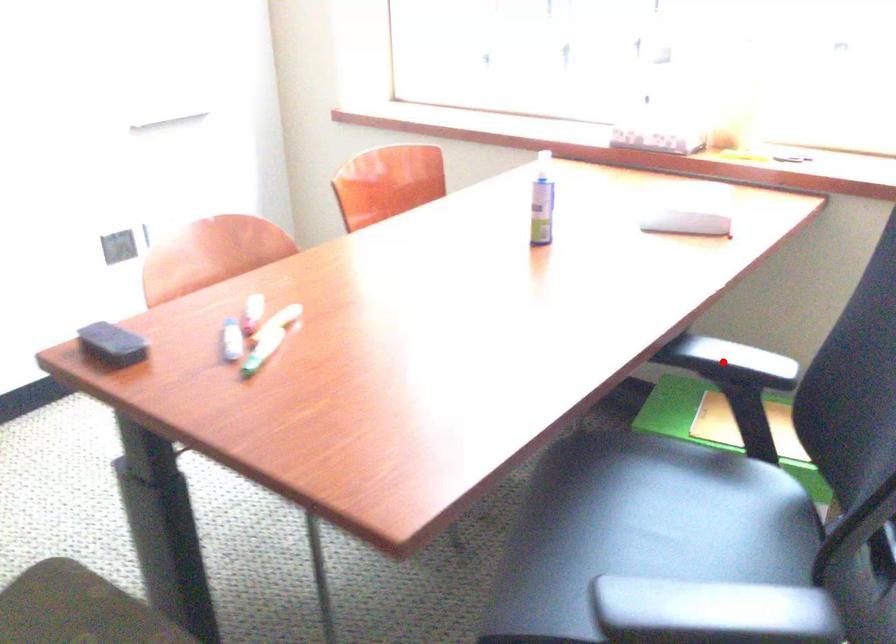
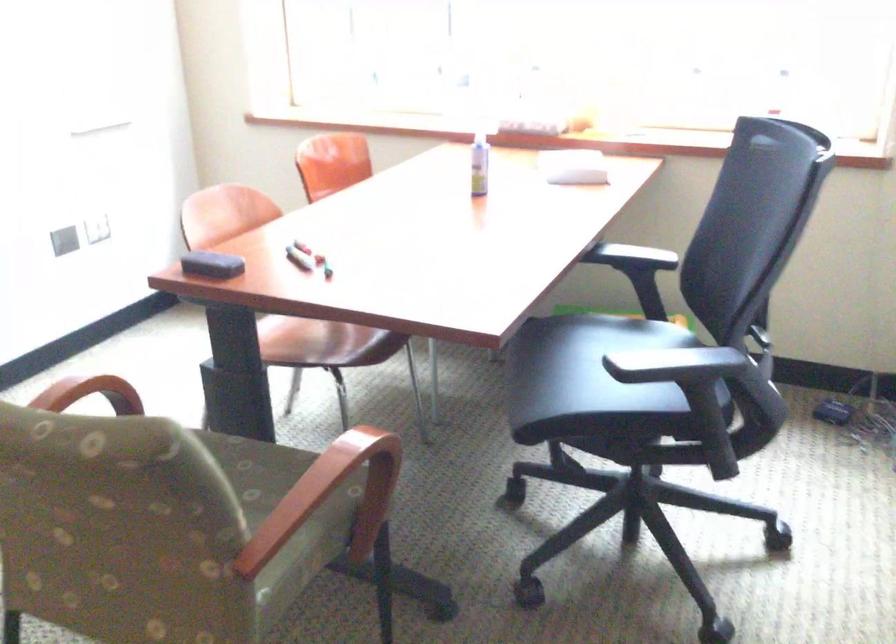
Question: I am providing you with two images of the same scene from different viewpoints. Image1 has a red point marked. In image2, the corresponding 3D location appears at what relative position? Reply with the corresponding letter.

Choices:
 (A) Closer
 (B) Farther

Answer: (B)